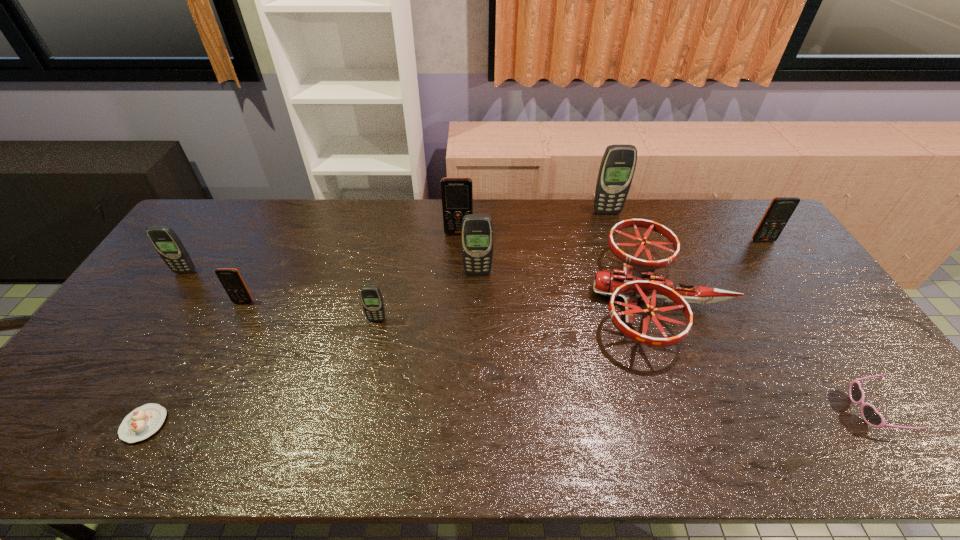
I want to click on the tallest object, so click(x=618, y=163).

I want to click on the farthest cellular telephone, so click(618, 163).

This screenshot has width=960, height=540. Find the location of `the biggest orange cellular telephone`. the biggest orange cellular telephone is located at coordinates (457, 192).

Identify the location of the sixth nearest cellular telephone. (457, 192).

Find the location of a particular element. The width and height of the screenshot is (960, 540). the third smallest gray cellular telephone is located at coordinates (477, 236).

Where is `the third biggest gray cellular telephone`? the third biggest gray cellular telephone is located at coordinates (166, 242).

I want to click on the leftmost object, so click(166, 242).

Identify the location of the second farthest orange cellular telephone. The image size is (960, 540). (781, 208).

Locate an element on the screen. The image size is (960, 540). the fifth nearest cellular telephone is located at coordinates (781, 208).

This screenshot has height=540, width=960. I want to click on the nearest orange cellular telephone, so click(230, 278).